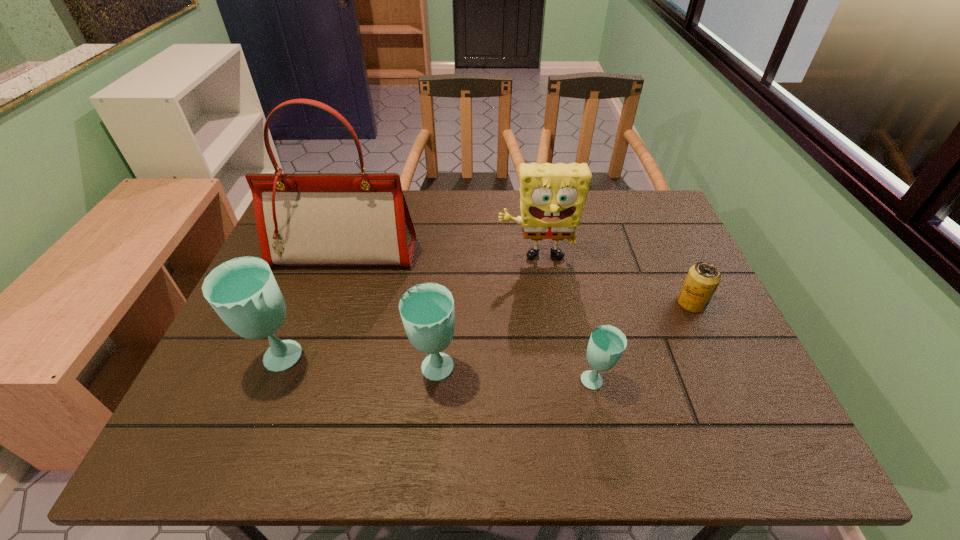
Identify the location of free space that satisfies the following two spatial constraints: 1. on the face of the sponge; 2. on the right side of the rightmost object. (542, 303).

Find the location of a particular element. vacant area in the image that satisfies the following two spatial constraints: 1. on the face of the sponge; 2. on the left side of the beer can is located at coordinates (542, 303).

Find the location of a particular element. free space that satisfies the following two spatial constraints: 1. on the front side of the leftmost glass; 2. on the left side of the third shortest object is located at coordinates (276, 371).

The image size is (960, 540). Identify the location of free space that satisfies the following two spatial constraints: 1. on the back side of the third shortest object; 2. on the left side of the beer can. (441, 303).

Identify the location of free space that satisfies the following two spatial constraints: 1. on the back side of the leftmost glass; 2. on the left side of the beer can. (302, 303).

Locate an element on the screen. blank space that satisfies the following two spatial constraints: 1. on the front side of the rightmost glass; 2. on the left side of the leftmost glass is located at coordinates (272, 381).